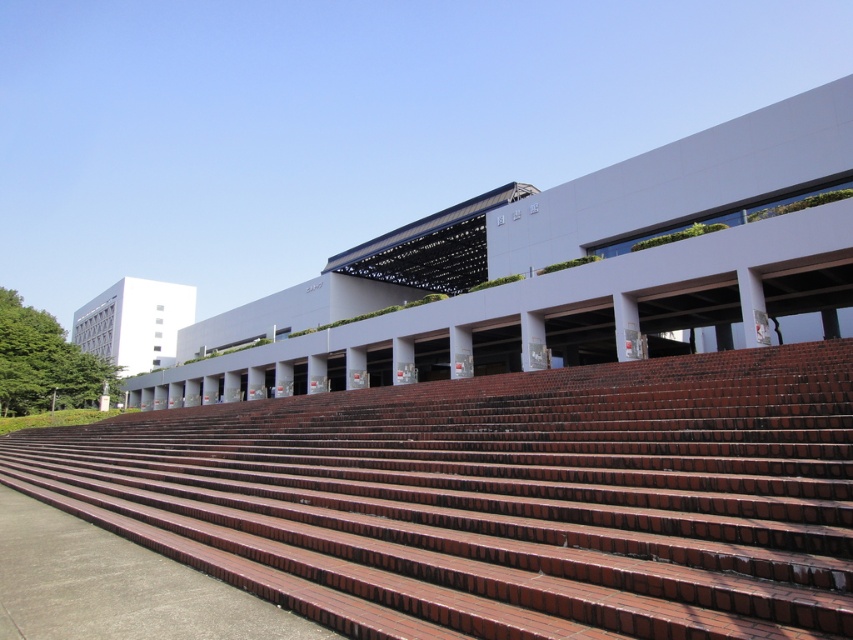
Question: Is brown brick stairs at center positioned behind brown brick amphitheater at center?

Choices:
 (A) no
 (B) yes

Answer: (A)

Question: Among these points, which one is nearest to the camera?

Choices:
 (A) (239, 349)
 (B) (640, 465)

Answer: (B)

Question: Which point is closer to the camera?

Choices:
 (A) (688, 529)
 (B) (479, 250)

Answer: (A)

Question: Does brown brick stairs at center appear under brown brick amphitheater at center?

Choices:
 (A) no
 (B) yes

Answer: (B)

Question: Is brown brick stairs at center to the left of brown brick amphitheater at center from the viewer's perspective?

Choices:
 (A) no
 (B) yes

Answer: (A)